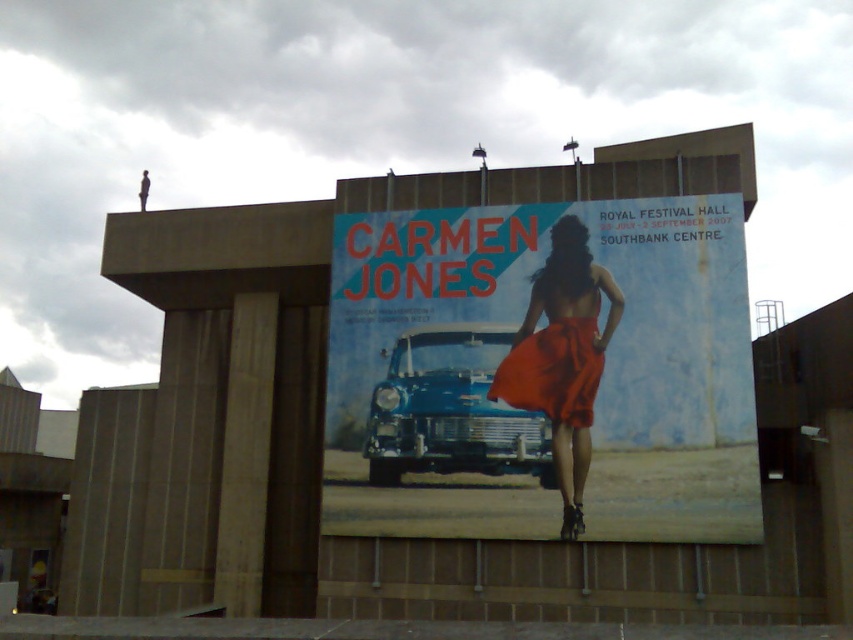
Question: Is satin red dress at center below matte orange fabric dress at center?

Choices:
 (A) yes
 (B) no

Answer: (A)

Question: Does satin red dress at center appear over matte orange fabric dress at center?

Choices:
 (A) yes
 (B) no

Answer: (B)

Question: Which point is closer to the camera?

Choices:
 (A) matte red fabric at center
 (B) satin red dress at center

Answer: (A)

Question: Is matte red fabric at center below satin red dress at center?

Choices:
 (A) yes
 (B) no

Answer: (B)

Question: Which of the following is the farthest from the observer?

Choices:
 (A) matte orange fabric dress at center
 (B) matte red fabric at center

Answer: (A)

Question: Which of the following is the closest to the observer?

Choices:
 (A) satin red dress at center
 (B) matte orange fabric dress at center

Answer: (A)